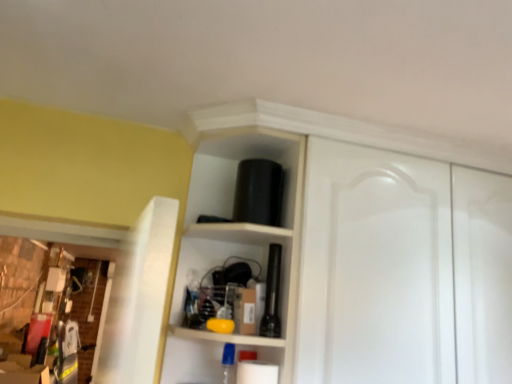
Question: From their relative heights in the image, would you say black matte flashlight at center is taller or shorter than white matte cabinet at upper center?

Choices:
 (A) tall
 (B) short

Answer: (B)

Question: Considering their positions, is black matte flashlight at center located in front of or behind white matte cabinet at upper center?

Choices:
 (A) behind
 (B) front

Answer: (A)

Question: From the image's perspective, relative to white matte cabinet at upper center, is black matte flashlight at center above or below?

Choices:
 (A) above
 (B) below

Answer: (B)

Question: Choose the correct answer: Is white matte cabinet at upper center inside black matte flashlight at center or outside it?

Choices:
 (A) inside
 (B) outside

Answer: (B)

Question: In terms of height, does white matte cabinet at upper center look taller or shorter compared to black matte flashlight at center?

Choices:
 (A) short
 (B) tall

Answer: (B)

Question: From the image's perspective, is white matte cabinet at upper center located above or below black matte flashlight at center?

Choices:
 (A) below
 (B) above

Answer: (B)

Question: From a real-world perspective, is white matte cabinet at upper center positioned above or below black matte flashlight at center?

Choices:
 (A) below
 (B) above

Answer: (B)